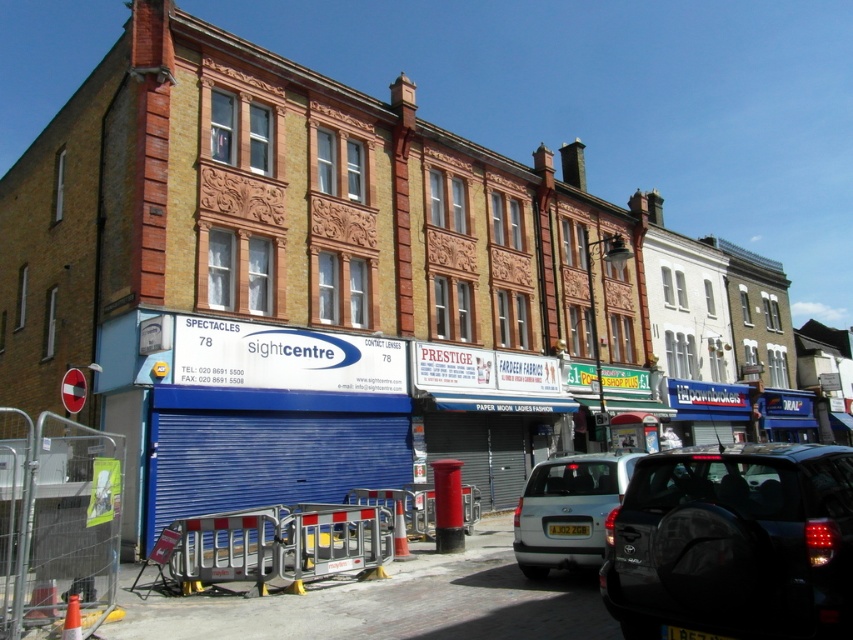
Is dark gray matte suv at lower right positioned before silver metallic car at center?

That is True.

Can you confirm if dark gray matte suv at lower right is wider than silver metallic car at center?

Correct, the width of dark gray matte suv at lower right exceeds that of silver metallic car at center.

Is point (654, 538) farther from camera compared to point (563, 548)?

No, (654, 538) is in front of (563, 548).

Find the location of a particular element. Image resolution: width=853 pixels, height=640 pixels. dark gray matte suv at lower right is located at coordinates (733, 544).

Is metallic silver barricade at lower center shorter than silver metallic car at center?

Yes, metallic silver barricade at lower center is shorter than silver metallic car at center.

Where is `metallic silver barricade at lower center`? This screenshot has width=853, height=640. metallic silver barricade at lower center is located at coordinates (274, 545).

From the picture: Who is more distant from viewer, (183,586) or (575,456)?

The point (575,456) is behind.

Where is `metallic silver barricade at lower center`? The width and height of the screenshot is (853, 640). metallic silver barricade at lower center is located at coordinates (274, 545).

Can you confirm if dark gray matte suv at lower right is wider than metallic silver barricade at lower center?

No.

Which is in front, point (782, 474) or point (229, 544)?

Point (782, 474) is in front.

Where is `dark gray matte suv at lower right`? The width and height of the screenshot is (853, 640). dark gray matte suv at lower right is located at coordinates (733, 544).